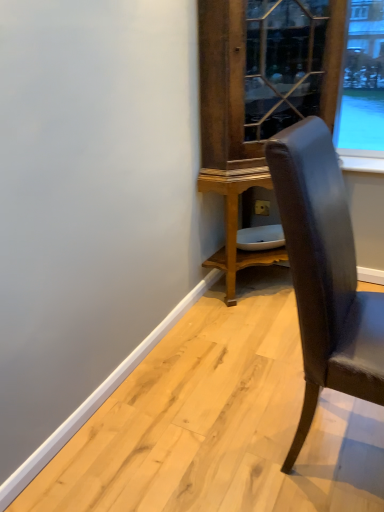
Question: Choose the correct answer: Is leather chair at right inside wooden glossy dresser at center or outside it?

Choices:
 (A) outside
 (B) inside

Answer: (A)

Question: In the image, is leather chair at right positioned in front of or behind wooden glossy dresser at center?

Choices:
 (A) front
 (B) behind

Answer: (A)

Question: From their relative heights in the image, would you say leather chair at right is taller or shorter than wooden glossy dresser at center?

Choices:
 (A) short
 (B) tall

Answer: (A)

Question: In terms of width, does wooden glossy dresser at center look wider or thinner when compared to leather chair at right?

Choices:
 (A) wide
 (B) thin

Answer: (A)

Question: In the image, is wooden glossy dresser at center positioned in front of or behind leather chair at right?

Choices:
 (A) behind
 (B) front

Answer: (A)

Question: Is wooden glossy dresser at center taller or shorter than leather chair at right?

Choices:
 (A) short
 (B) tall

Answer: (B)

Question: Considering the positions of point (231, 50) and point (292, 189), is point (231, 50) closer or farther from the camera than point (292, 189)?

Choices:
 (A) closer
 (B) farther

Answer: (B)